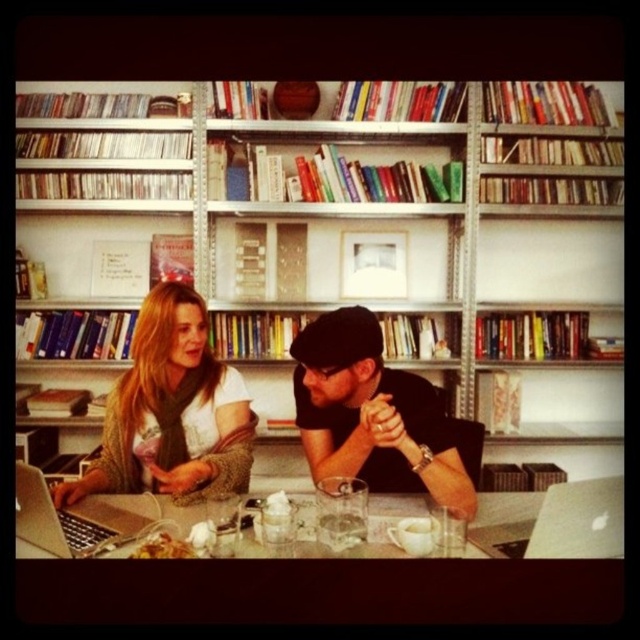
Is matte white scarf at center below black matte hat at center?

No, matte white scarf at center is not below black matte hat at center.

Does matte white scarf at center have a greater height compared to black matte hat at center?

Yes.

Does point (138, 420) lie in front of point (333, 372)?

No, (138, 420) is further to viewer.

You are a GUI agent. You are given a task and a screenshot of the screen. Output one action in this format:
    pyautogui.click(x=<x>, y=<y>)
    Task: Click on the matte white scarf at center
    The width and height of the screenshot is (640, 640).
    Given the screenshot: What is the action you would take?
    pyautogui.click(x=172, y=412)

Between black matte hat at center and silver metallic laptop at lower left, which one is positioned higher?

black matte hat at center

Which is in front, point (339, 323) or point (115, 508)?

Positioned in front is point (339, 323).

At what (x,y) coordinates should I click in order to perform the action: click on black matte hat at center. Please return your answer as a coordinate pair (x, y). The height and width of the screenshot is (640, 640). Looking at the image, I should click on (372, 413).

Can you confirm if black matte hat at center is positioned above wooden table at center?

Correct, black matte hat at center is located above wooden table at center.

The image size is (640, 640). Describe the element at coordinates (372, 413) in the screenshot. I see `black matte hat at center` at that location.

What do you see at coordinates (372, 413) in the screenshot? I see `black matte hat at center` at bounding box center [372, 413].

Locate an element on the screen. This screenshot has width=640, height=640. black matte hat at center is located at coordinates (372, 413).